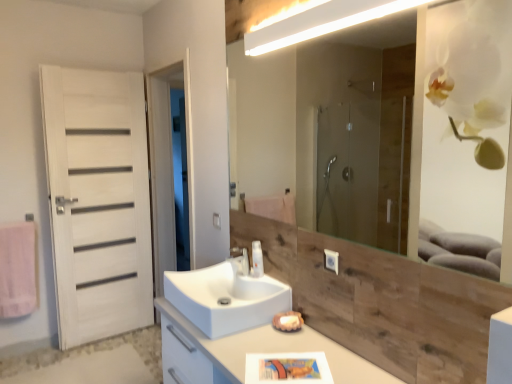
Question: From the image's perspective, relative to pink fabric towel at left, is white wood door at left above or below?

Choices:
 (A) below
 (B) above

Answer: (B)

Question: Considering the positions of point (86, 342) and point (19, 226), is point (86, 342) closer or farther from the camera than point (19, 226)?

Choices:
 (A) closer
 (B) farther

Answer: (B)

Question: Estimate the real-world distances between objects in this image. Which object is farther from the translucent plastic soap dispenser at center?

Choices:
 (A) white glossy cabinet at center
 (B) white matte door at left
 (C) pink fabric towel at left
 (D) white glossy light fixture at upper center
 (E) wooden/matte mirror at upper center

Answer: (E)

Question: Which object is positioned closest to the white glossy light fixture at upper center?

Choices:
 (A) white glossy sink at center
 (B) white matte door at left
 (C) wooden/matte mirror at upper center
 (D) white glossy tap at center
 (E) white wood door at left

Answer: (D)